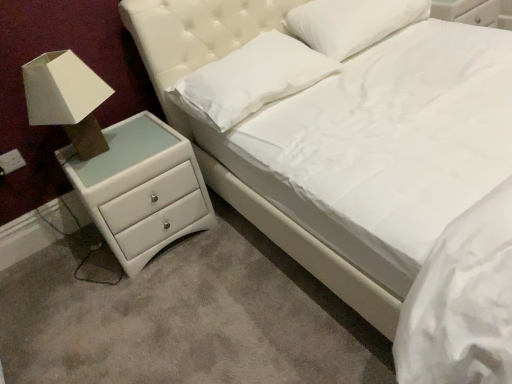
Question: From the image's perspective, is white soft pillow at upper center, which ranks as the second pillow in left-to-right order, on white fabric lampshade at left?

Choices:
 (A) no
 (B) yes

Answer: (B)

Question: From a real-world perspective, is white soft pillow at upper center, which ranks as the second pillow in left-to-right order, under white fabric lampshade at left?

Choices:
 (A) no
 (B) yes

Answer: (B)

Question: Does white soft pillow at upper center, which ranks as the second pillow in left-to-right order, have a greater height compared to white fabric lampshade at left?

Choices:
 (A) no
 (B) yes

Answer: (A)

Question: Considering the relative sizes of white soft pillow at upper center, the first pillow positioned from the right, and white fabric lampshade at left in the image provided, is white soft pillow at upper center, the first pillow positioned from the right, shorter than white fabric lampshade at left?

Choices:
 (A) yes
 (B) no

Answer: (A)

Question: Is the depth of white soft pillow at upper center, which ranks as the second pillow in left-to-right order, greater than that of white fabric lampshade at left?

Choices:
 (A) yes
 (B) no

Answer: (A)

Question: Is point (188, 114) positioned closer to the camera than point (64, 162)?

Choices:
 (A) farther
 (B) closer

Answer: (A)

Question: Which is correct: white soft pillow at upper center, which appears as the first pillow when viewed from the left, is inside white leather chest of drawers at lower left, or outside of it?

Choices:
 (A) inside
 (B) outside

Answer: (B)

Question: In the image, is white soft pillow at upper center, which appears as the first pillow when viewed from the left, positioned in front of or behind white leather chest of drawers at lower left?

Choices:
 (A) behind
 (B) front

Answer: (A)

Question: Looking at the image, does white soft pillow at upper center, which appears as the first pillow when viewed from the left, seem bigger or smaller compared to white leather chest of drawers at lower left?

Choices:
 (A) big
 (B) small

Answer: (B)

Question: Is white soft pillow at upper center, which ranks as the second pillow in left-to-right order, taller or shorter than white leather chest of drawers at lower left?

Choices:
 (A) short
 (B) tall

Answer: (A)

Question: From the image's perspective, relative to white leather chest of drawers at lower left, is white soft pillow at upper center, the first pillow positioned from the right, above or below?

Choices:
 (A) below
 (B) above

Answer: (B)

Question: Relative to white leather chest of drawers at lower left, is white soft pillow at upper center, which ranks as the second pillow in left-to-right order, in front or behind?

Choices:
 (A) behind
 (B) front

Answer: (A)

Question: Is white soft pillow at upper center, the first pillow positioned from the right, to the left or to the right of white leather chest of drawers at lower left in the image?

Choices:
 (A) left
 (B) right

Answer: (B)

Question: Is white leather chest of drawers at lower left spatially inside white fabric lampshade at left, or outside of it?

Choices:
 (A) inside
 (B) outside

Answer: (B)

Question: Looking at the image, does white leather chest of drawers at lower left seem bigger or smaller compared to white fabric lampshade at left?

Choices:
 (A) big
 (B) small

Answer: (A)